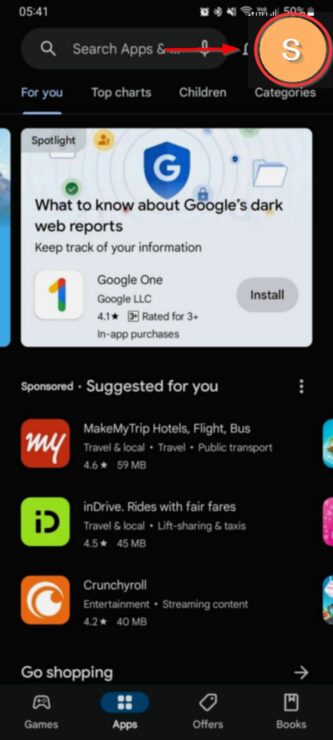
This screenshot has height=740, width=333. Identify the location of spotlight. (52, 140).